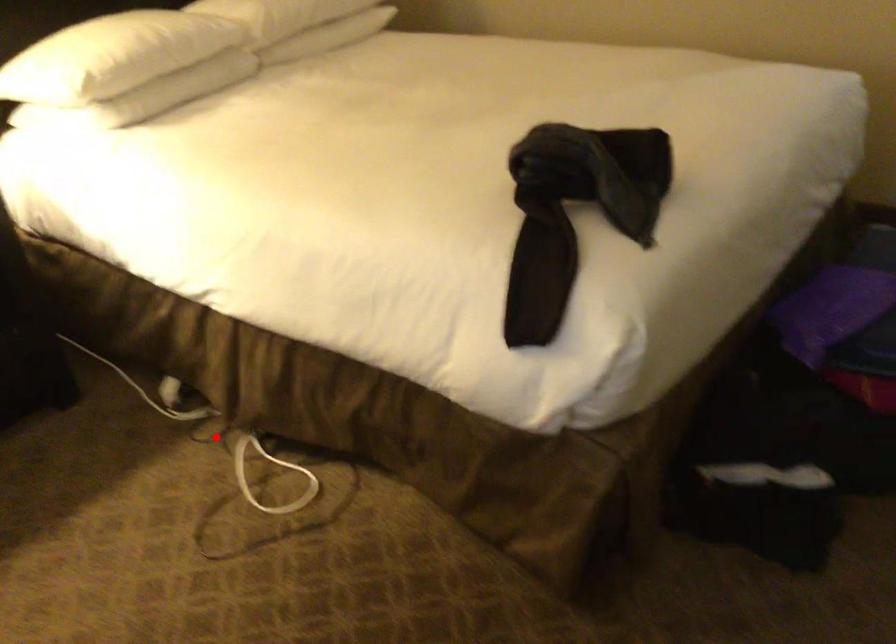
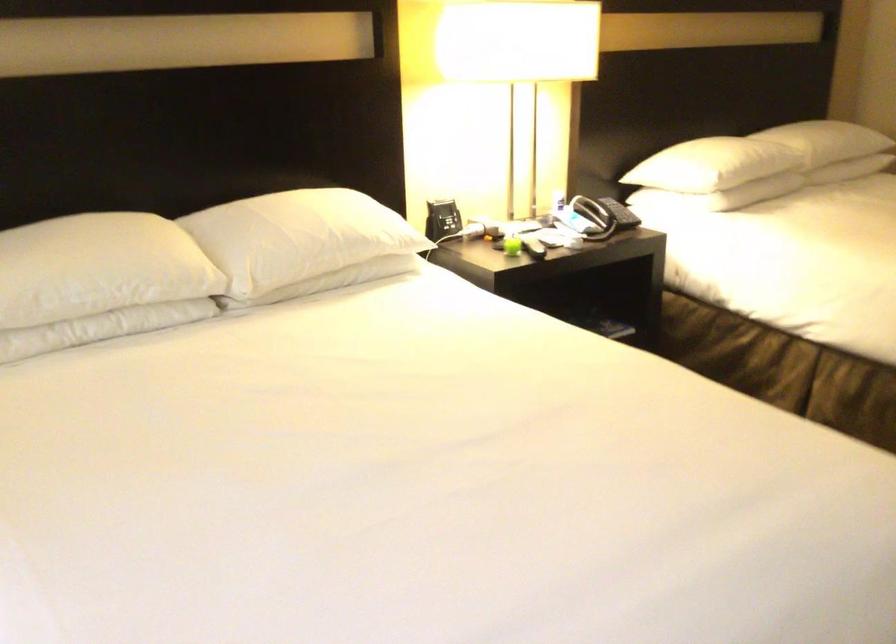
Question: I am providing you with two images of the same scene from different viewpoints. A red point is marked on the first image. Can you still see the location of the red point in image 2?

Choices:
 (A) Yes
 (B) No

Answer: (B)